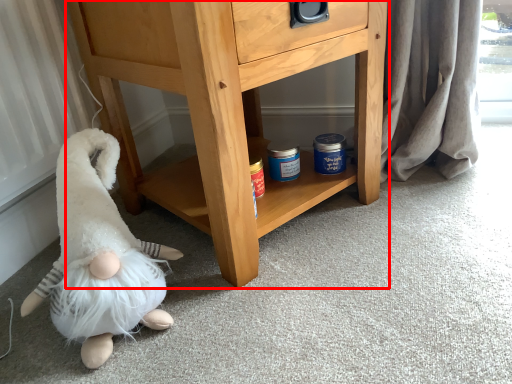
Question: From the image's perspective, considering the relative positions of chest of drawers (annotated by the red box) and toy in the image provided, where is chest of drawers (annotated by the red box) located with respect to the staircase?

Choices:
 (A) below
 (B) above

Answer: (B)